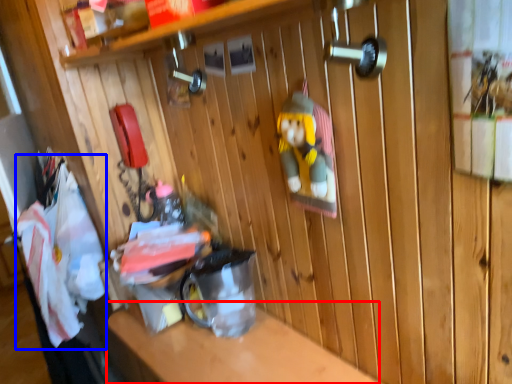
Question: Which point is closer to the camera, counter top (highlighted by a red box) or laundry (highlighted by a blue box)?

Choices:
 (A) counter top
 (B) laundry

Answer: (A)